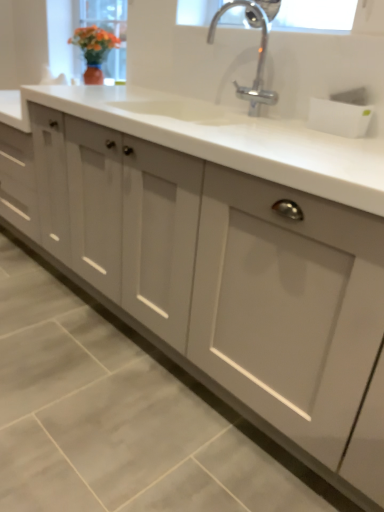
Question: From a real-world perspective, is chrome metallic faucet at upper center positioned above or below clear glass window screen at upper center?

Choices:
 (A) above
 (B) below

Answer: (B)

Question: Considering the positions of chrome metallic faucet at upper center and clear glass window screen at upper center in the image, is chrome metallic faucet at upper center taller or shorter than clear glass window screen at upper center?

Choices:
 (A) short
 (B) tall

Answer: (B)

Question: Does point (206, 41) appear closer or farther from the camera than point (332, 7)?

Choices:
 (A) closer
 (B) farther

Answer: (B)

Question: From a real-world perspective, is clear glass window screen at upper center above or below chrome metallic faucet at upper center?

Choices:
 (A) below
 (B) above

Answer: (B)

Question: Considering the positions of clear glass window screen at upper center and chrome metallic faucet at upper center in the image, is clear glass window screen at upper center bigger or smaller than chrome metallic faucet at upper center?

Choices:
 (A) big
 (B) small

Answer: (B)

Question: In terms of height, does clear glass window screen at upper center look taller or shorter compared to chrome metallic faucet at upper center?

Choices:
 (A) tall
 (B) short

Answer: (B)

Question: Choose the correct answer: Is clear glass window screen at upper center inside chrome metallic faucet at upper center or outside it?

Choices:
 (A) outside
 (B) inside

Answer: (A)